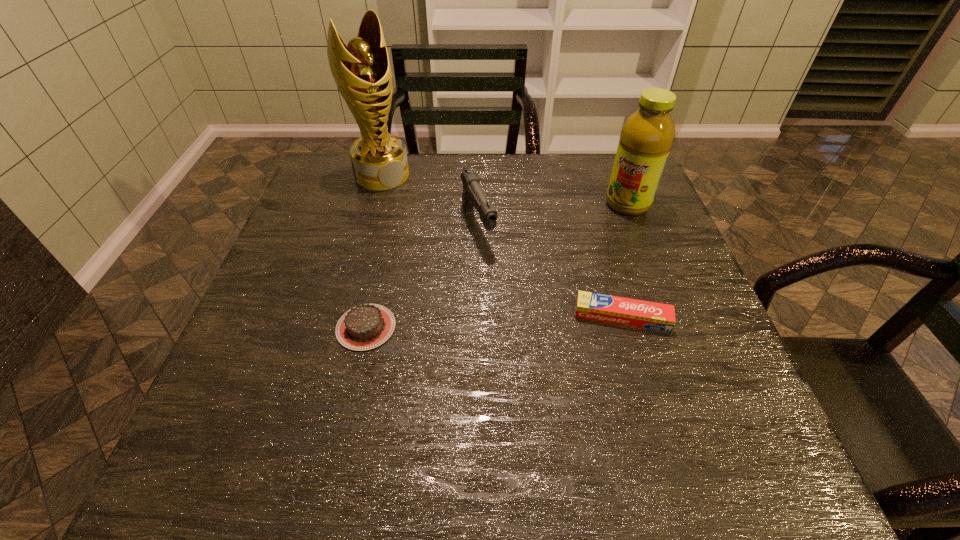
The image size is (960, 540). In order to click on vacant area located 0.250m on the front-facing side of the award in this screenshot , I will do `click(443, 235)`.

What are the coordinates of `vacant point located in the direction the third shortest object is aimed` in the screenshot? It's located at (504, 296).

Locate an element on the screen. blank space located in the direction the third shortest object is aimed is located at coordinates (521, 331).

Identify the location of free space located in the direction the third shortest object is aimed. Image resolution: width=960 pixels, height=540 pixels. (517, 323).

Identify the location of vacant space situated 0.230m on the front label of the second tallest object. (571, 262).

Identify the location of free location located on the front label of the second tallest object. The image size is (960, 540). (555, 279).

Locate an element on the screen. vacant space located on the front label of the second tallest object is located at coordinates (537, 296).

The width and height of the screenshot is (960, 540). Find the location of `award that is at the far edge`. award that is at the far edge is located at coordinates (362, 72).

The width and height of the screenshot is (960, 540). Identify the location of fruit juice present at the far edge. click(x=647, y=135).

Locate an element on the screen. This screenshot has width=960, height=540. object located at the left edge is located at coordinates (362, 72).